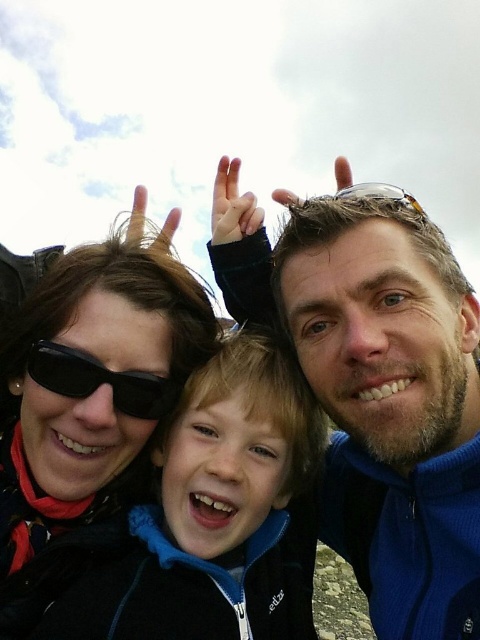
Question: Can you confirm if blue fleece jacket at center is positioned above black matte sunglasses at lower left?

Choices:
 (A) yes
 (B) no

Answer: (A)

Question: Which object is positioned closest to the blue fleece jacket at center?

Choices:
 (A) black matte sunglasses at upper left
 (B) black fleece jacket at center

Answer: (B)

Question: Does blue fleece jacket at center have a lesser width compared to black matte sunglasses at upper left?

Choices:
 (A) no
 (B) yes

Answer: (B)

Question: Can you confirm if black matte sunglasses at upper left is smaller than black matte sunglasses at lower left?

Choices:
 (A) no
 (B) yes

Answer: (A)

Question: Which object is the closest to the black matte sunglasses at upper left?

Choices:
 (A) black matte sunglasses at lower left
 (B) blue fleece jacket at center

Answer: (A)

Question: Which of the following is the closest to the observer?

Choices:
 (A) blue fleece jacket at center
 (B) black matte sunglasses at upper left
 (C) black fleece jacket at center
 (D) black matte sunglasses at lower left

Answer: (A)